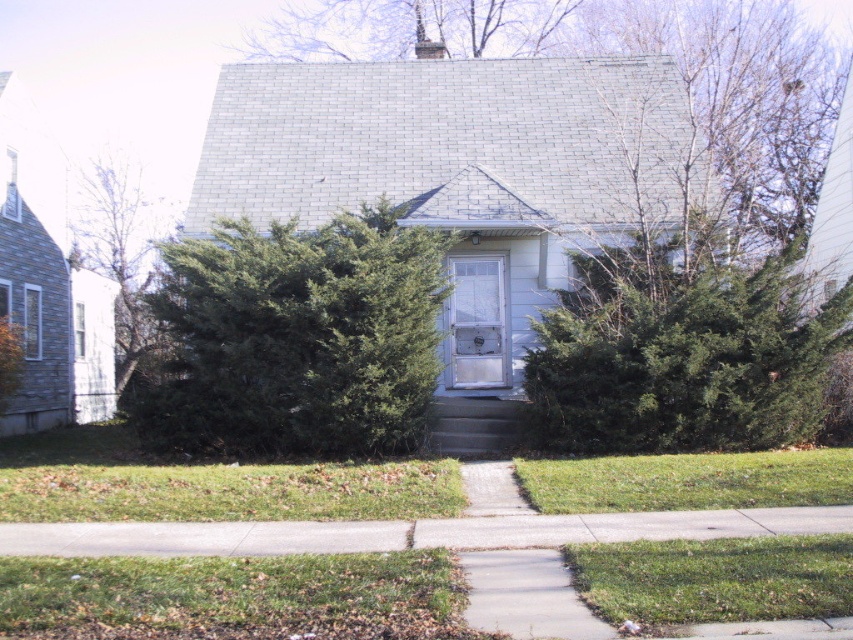
You are standing on the sidewalk in front of the house and want to walk to the front door. Is the green textured bush at center blocking your path?

The green textured bush at center is located at point (682, 352), so it is not blocking your path to the front door as it is positioned away from the direct route.